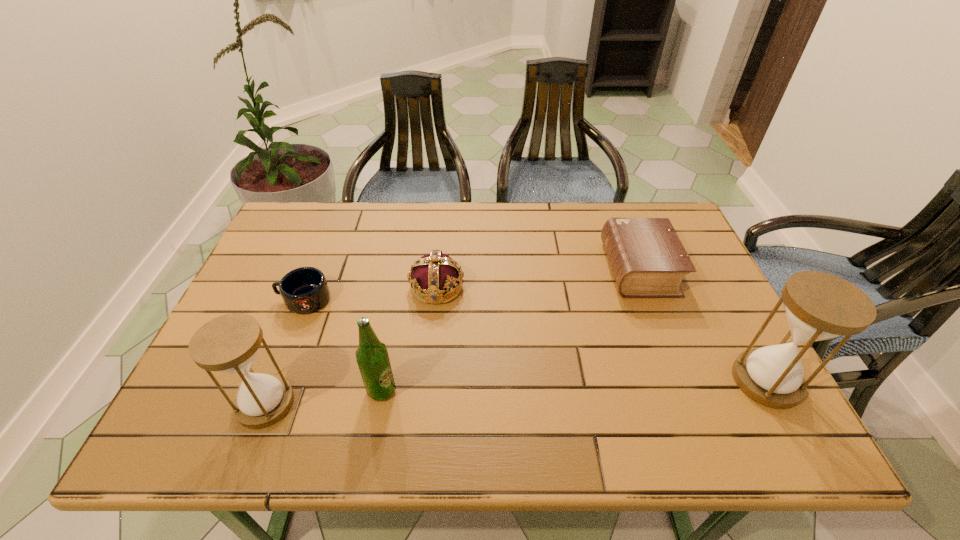
Locate an element on the screen. the left hourglass is located at coordinates (229, 343).

Where is `the right hourglass`? This screenshot has width=960, height=540. the right hourglass is located at coordinates (819, 306).

Find the location of a particular element. the rightmost object is located at coordinates (819, 306).

In order to click on the third shortest object in this screenshot , I will do `click(434, 274)`.

Image resolution: width=960 pixels, height=540 pixels. In order to click on the second shortest object in this screenshot , I will do `click(648, 260)`.

You are a GUI agent. You are given a task and a screenshot of the screen. Output one action in this format:
    pyautogui.click(x=<x>, y=<y>)
    Task: Click on the Bible
    The image size is (960, 540).
    Given the screenshot: What is the action you would take?
    pyautogui.click(x=648, y=260)

I want to click on mug, so click(x=304, y=290).

Locate an element on the screen. beer bottle is located at coordinates (372, 357).

In order to click on vacant space located on the back of the shorter hourglass in this screenshot , I will do `click(307, 296)`.

Locate an element on the screen. The width and height of the screenshot is (960, 540). free space located 0.330m on the back of the taller hourglass is located at coordinates [702, 261].